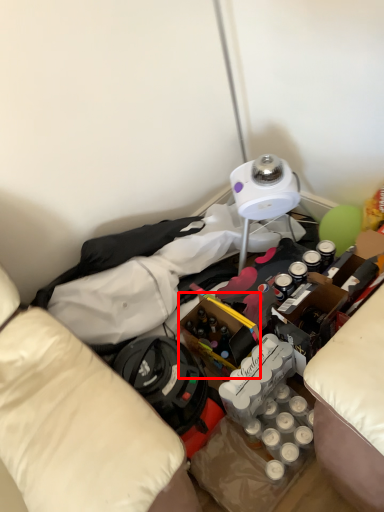
Question: Considering the relative positions of wine bottle (annotated by the red box) and clothing in the image provided, where is wine bottle (annotated by the red box) located with respect to the staircase?

Choices:
 (A) right
 (B) left

Answer: (A)